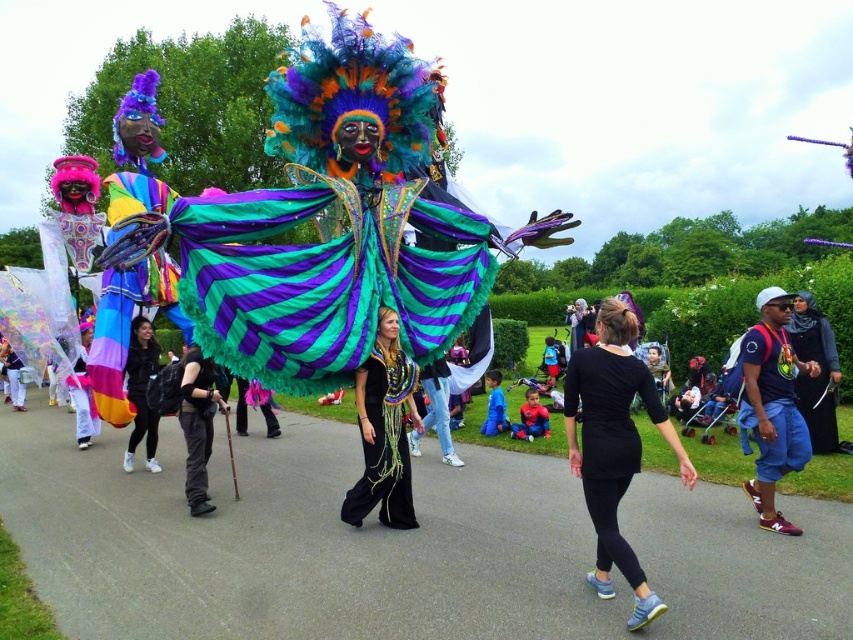
Question: Can you confirm if black matte leggings at lower center is positioned above black velvet dress at center?

Choices:
 (A) yes
 (B) no

Answer: (A)

Question: Which point appears farthest from the camera in this image?

Choices:
 (A) (389, 376)
 (B) (570, 372)
 (C) (152, 336)

Answer: (C)

Question: Based on their relative distances, which object is farther from the black satin robe at right?

Choices:
 (A) black matte leggings at lower center
 (B) matte black leggings at center

Answer: (B)

Question: Among these points, which one is farthest from the camera?

Choices:
 (A) (204, 417)
 (B) (151, 449)
 (C) (756, 442)
 (D) (619, 417)

Answer: (B)

Question: Does black matte leggings at lower center have a greater width compared to matte black backpack at center?

Choices:
 (A) no
 (B) yes

Answer: (B)

Question: Can you confirm if blue cotton shorts at right is positioned to the right of matte black backpack at center?

Choices:
 (A) yes
 (B) no

Answer: (A)